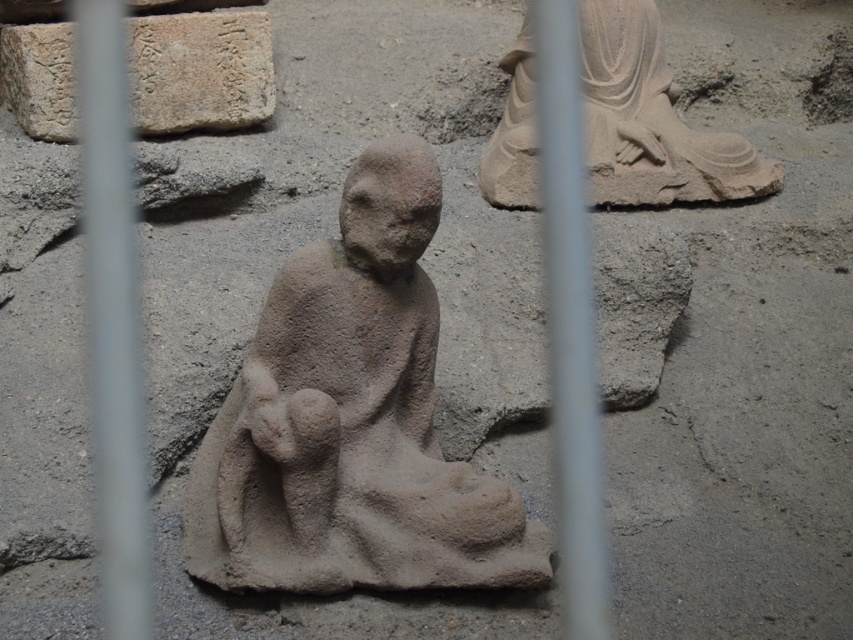
How far apart are gray stone statue at center and smooth stone statue at upper right?

They are 35.44 inches apart.

Who is more distant from viewer, (216, 524) or (660, 152)?

The point (660, 152) is behind.

Locate an element on the screen. This screenshot has width=853, height=640. gray stone statue at center is located at coordinates (352, 420).

Does gray stone statue at center come in front of gray stone plaque at upper left?

Yes, gray stone statue at center is in front of gray stone plaque at upper left.

Between gray stone statue at center and gray stone plaque at upper left, which one is positioned lower?

gray stone statue at center is below.

Where is `gray stone statue at center`? The width and height of the screenshot is (853, 640). gray stone statue at center is located at coordinates (352, 420).

Can you confirm if smooth stone statue at upper right is wider than gray stone plaque at upper left?

Yes.

Is smooth stone statue at upper right taller than gray stone plaque at upper left?

Yes.

Where is `smooth stone statue at upper right`? The height and width of the screenshot is (640, 853). smooth stone statue at upper right is located at coordinates (651, 120).